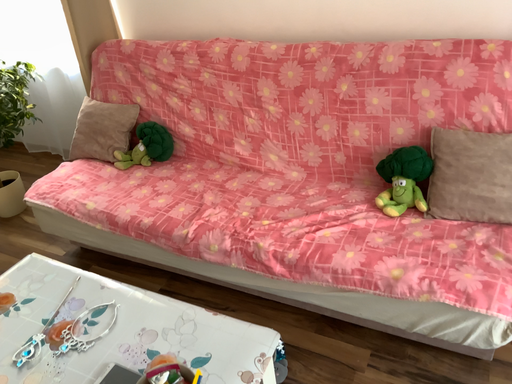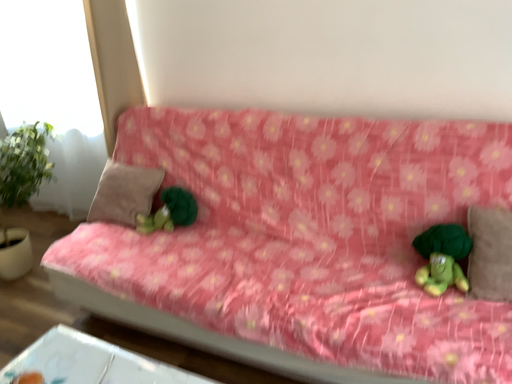
Question: Which way did the camera rotate in the video?

Choices:
 (A) rotated upward
 (B) rotated downward

Answer: (A)